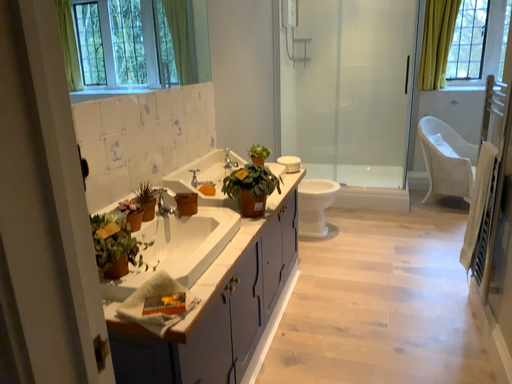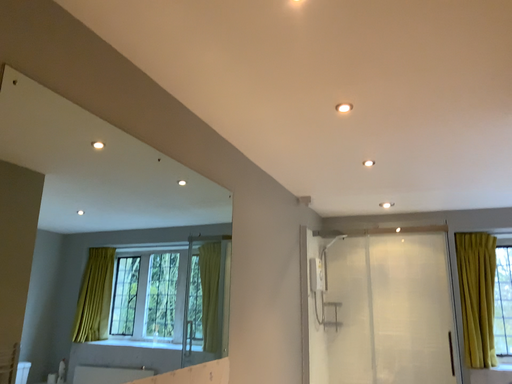
Question: How did the camera likely rotate when shooting the video?

Choices:
 (A) rotated downward
 (B) rotated upward

Answer: (B)